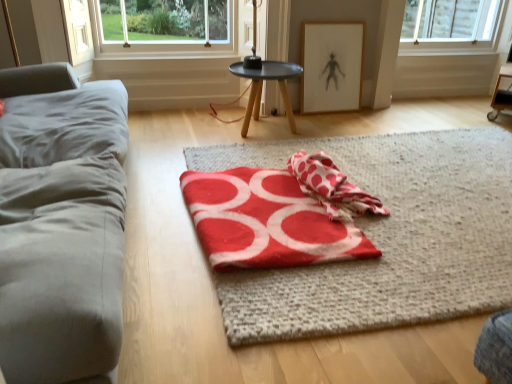
Image resolution: width=512 pixels, height=384 pixels. What do you see at coordinates (331, 66) in the screenshot?
I see `wooden framed artwork at upper center` at bounding box center [331, 66].

Find the location of a particular element. The height and width of the screenshot is (384, 512). wooden framed artwork at upper center is located at coordinates (331, 66).

Identify the location of matte black table at center. (262, 87).

Locate an element on the screen. red polka dot towel at center, which appears as the 1th beach towel when viewed from the right is located at coordinates point(332,187).

Considering the points (301, 208) and (356, 69), which point is in front, point (301, 208) or point (356, 69)?

Positioned in front is point (301, 208).

From a real-world perspective, who is located lower, red felt beach towel at center, which is the 2th beach towel in right-to-left order, or wooden framed artwork at upper center?

In real-world perspective, red felt beach towel at center, which is the 2th beach towel in right-to-left order, is lower.

Does red felt beach towel at center, which is the first beach towel in left-to-right order, appear on the left side of wooden framed artwork at upper center?

Yes.

Considering the relative sizes of red polka dot towel at center, which appears as the 1th beach towel when viewed from the right, and matte black table at center in the image provided, is red polka dot towel at center, which appears as the 1th beach towel when viewed from the right, wider than matte black table at center?

In fact, red polka dot towel at center, which appears as the 1th beach towel when viewed from the right, might be narrower than matte black table at center.

Is red polka dot towel at center, the 2th beach towel when ordered from left to right, closer to camera compared to matte black table at center?

That is True.

How different are the orientations of red polka dot towel at center, the 2th beach towel when ordered from left to right, and matte black table at center in degrees?

There is a 93.9-degree angle between the facing directions of red polka dot towel at center, the 2th beach towel when ordered from left to right, and matte black table at center.

Based on the photo, between gray fabric couch at left and red felt beach towel at center, which is the 2th beach towel in right-to-left order, which one has smaller width?

Thinner between the two is red felt beach towel at center, which is the 2th beach towel in right-to-left order.

In the scene shown: Can you tell me how much gray fabric couch at left and red felt beach towel at center, which is the 2th beach towel in right-to-left order, differ in facing direction?

gray fabric couch at left and red felt beach towel at center, which is the 2th beach towel in right-to-left order, are facing 2.87 degrees away from each other.

Which is correct: gray fabric couch at left is inside red felt beach towel at center, which is the 2th beach towel in right-to-left order, or outside of it?

gray fabric couch at left lies outside red felt beach towel at center, which is the 2th beach towel in right-to-left order.

Does point (9, 236) appear closer or farther from the camera than point (244, 203)?

Point (9, 236) appears to be closer to the viewer than point (244, 203).

Is red felt beach towel at center, which is the 2th beach towel in right-to-left order, not near red polka dot towel at center, which appears as the 1th beach towel when viewed from the right?

They are positioned close to each other.

Does red felt beach towel at center, which is the first beach towel in left-to-right order, turn towards red polka dot towel at center, which appears as the 1th beach towel when viewed from the right?

Yes, red felt beach towel at center, which is the first beach towel in left-to-right order, is turned towards red polka dot towel at center, which appears as the 1th beach towel when viewed from the right.

Does point (294, 262) appear closer or farther from the camera than point (333, 219)?

Point (294, 262) is positioned closer to the camera compared to point (333, 219).

Is red felt beach towel at center, which is the 2th beach towel in right-to-left order, taller or shorter than red polka dot towel at center, the 2th beach towel when ordered from left to right?

Clearly, red felt beach towel at center, which is the 2th beach towel in right-to-left order, is shorter compared to red polka dot towel at center, the 2th beach towel when ordered from left to right.

From a real-world perspective, which object rests below the other?

red felt beach towel at center, which is the first beach towel in left-to-right order.

Is point (300, 74) positioned before point (330, 235)?

No.

Is matte black table at center taller than red felt beach towel at center, which is the 2th beach towel in right-to-left order?

Yes, matte black table at center is taller than red felt beach towel at center, which is the 2th beach towel in right-to-left order.

Is matte black table at center wider than red felt beach towel at center, which is the first beach towel in left-to-right order?

In fact, matte black table at center might be narrower than red felt beach towel at center, which is the first beach towel in left-to-right order.

Is matte black table at center outside of gray fabric couch at left?

Yes, matte black table at center is located beyond the bounds of gray fabric couch at left.

In the image, is matte black table at center positioned in front of or behind gray fabric couch at left?

matte black table at center is positioned farther from the viewer than gray fabric couch at left.

What's the angular difference between matte black table at center and gray fabric couch at left's facing directions?

The facing directions of matte black table at center and gray fabric couch at left are 90 degrees apart.

Is matte black table at center positioned with its back to gray fabric couch at left?

No, matte black table at center is not facing away from gray fabric couch at left.

Considering the sizes of objects red woolen blanket at center and wooden framed artwork at upper center in the image provided, who is shorter, red woolen blanket at center or wooden framed artwork at upper center?

With less height is red woolen blanket at center.

What's the angular difference between red woolen blanket at center and wooden framed artwork at upper center's facing directions?

red woolen blanket at center and wooden framed artwork at upper center are facing 90.9 degrees away from each other.

Looking at the image, does red woolen blanket at center seem bigger or smaller compared to wooden framed artwork at upper center?

red woolen blanket at center is bigger than wooden framed artwork at upper center.

Which beach towel is the 2nd one when counting from the front of the wooden framed artwork at upper center? Please provide its 2D coordinates.

[(265, 221)]

In order to click on table on the left of red polka dot towel at center, the 2th beach towel when ordered from left to right in this screenshot , I will do `click(262, 87)`.

When comparing their distances from wooden framed artwork at upper center, does red polka dot towel at center, the 2th beach towel when ordered from left to right, or matte black table at center seem closer?

matte black table at center.

Looking at the image, which one is located closer to matte black table at center, red polka dot towel at center, the 2th beach towel when ordered from left to right, or wooden framed artwork at upper center?

The object closer to matte black table at center is wooden framed artwork at upper center.

Based on their spatial positions, is red woolen blanket at center or gray fabric couch at left closer to red felt beach towel at center, which is the first beach towel in left-to-right order?

The object closer to red felt beach towel at center, which is the first beach towel in left-to-right order, is red woolen blanket at center.

Considering their positions, is red polka dot towel at center, which appears as the 1th beach towel when viewed from the right, positioned closer to gray fabric couch at left than red woolen blanket at center?

Based on the image, red polka dot towel at center, which appears as the 1th beach towel when viewed from the right, appears to be nearer to gray fabric couch at left.

Based on their spatial positions, is gray fabric couch at left or red woolen blanket at center closer to red felt beach towel at center, which is the first beach towel in left-to-right order?

red woolen blanket at center is positioned closer to the anchor red felt beach towel at center, which is the first beach towel in left-to-right order.

Based on the photo, based on their spatial positions, is red woolen blanket at center or gray fabric couch at left closer to matte black table at center?

The object closer to matte black table at center is red woolen blanket at center.

Looking at the image, which one is located closer to gray fabric couch at left, red felt beach towel at center, which is the 2th beach towel in right-to-left order, or matte black table at center?

red felt beach towel at center, which is the 2th beach towel in right-to-left order, is positioned closer to the anchor gray fabric couch at left.

Looking at the image, which one is located closer to matte black table at center, wooden framed artwork at upper center or gray fabric couch at left?

wooden framed artwork at upper center is closer to matte black table at center.

Where is `yoga mat positioned between gray fabric couch at left and wooden framed artwork at upper center from near to far`? The height and width of the screenshot is (384, 512). yoga mat positioned between gray fabric couch at left and wooden framed artwork at upper center from near to far is located at coordinates (386, 236).

Identify the location of table located between red felt beach towel at center, which is the 2th beach towel in right-to-left order, and wooden framed artwork at upper center in the depth direction. Image resolution: width=512 pixels, height=384 pixels. (262, 87).

Locate an element on the screen. Image resolution: width=512 pixels, height=384 pixels. table positioned between red polka dot towel at center, which appears as the 1th beach towel when viewed from the right, and wooden framed artwork at upper center from near to far is located at coordinates (262, 87).

You are a GUI agent. You are given a task and a screenshot of the screen. Output one action in this format:
    pyautogui.click(x=<x>, y=<y>)
    Task: Click on the beach towel positioned between red felt beach towel at center, which is the first beach towel in left-to-right order, and wooden framed artwork at upper center from near to far
    This screenshot has width=512, height=384.
    Given the screenshot: What is the action you would take?
    pyautogui.click(x=332, y=187)